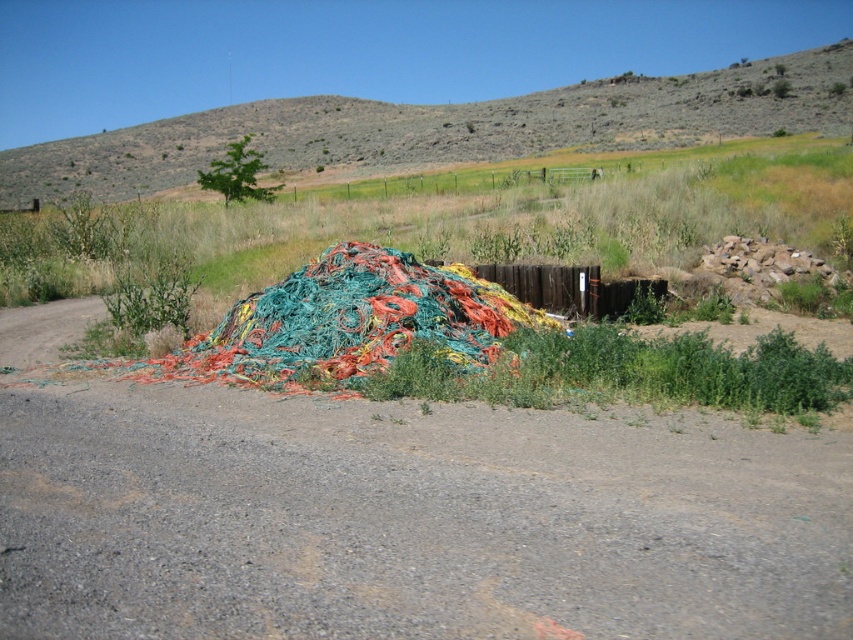
Question: Is dirt track at center smaller than dried grass at upper center?

Choices:
 (A) yes
 (B) no

Answer: (A)

Question: Does dirt track at center appear on the left side of dried grass at upper center?

Choices:
 (A) no
 (B) yes

Answer: (A)

Question: Which of the following is the closest to the observer?

Choices:
 (A) dirt track at center
 (B) dried grass at upper center

Answer: (A)

Question: Is dirt track at center smaller than dried grass at upper center?

Choices:
 (A) yes
 (B) no

Answer: (A)